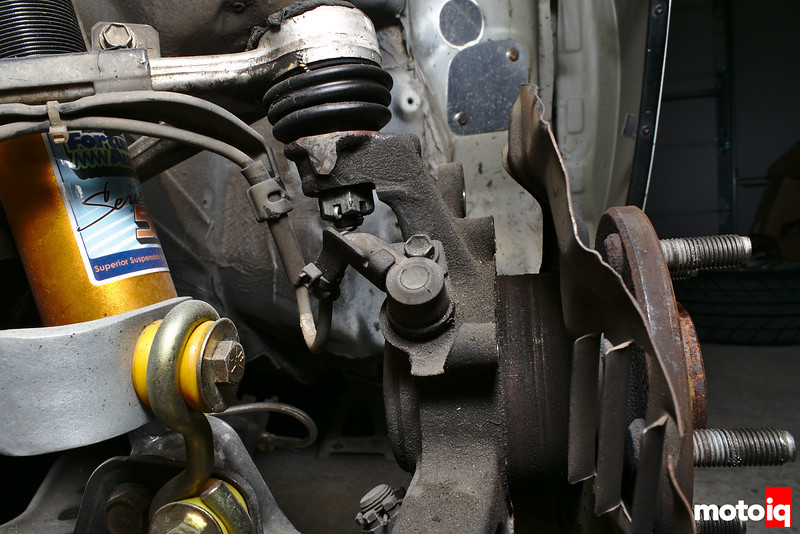
Find the location of a particular element. The height and width of the screenshot is (534, 800). wall is located at coordinates (762, 103).